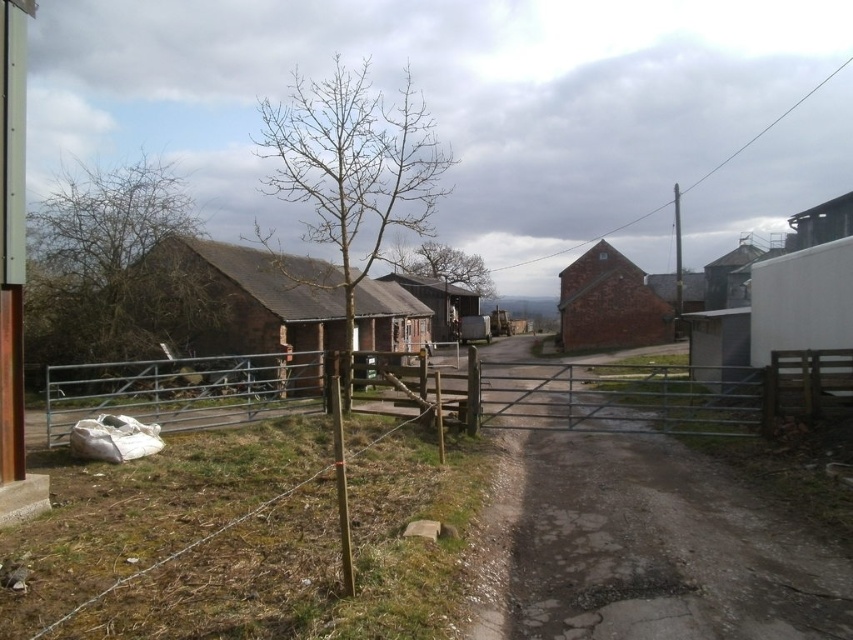
Question: Which point is closer to the camera?

Choices:
 (A) (178, 365)
 (B) (578, 340)
 (C) (407, 305)

Answer: (A)

Question: Which point appears closest to the camera in this image?

Choices:
 (A) (480, 276)
 (B) (625, 314)
 (C) (366, 342)

Answer: (C)

Question: Which of the following is the farthest from the observer?

Choices:
 (A) brown wooden hut at left
 (B) brown wooden hut at center
 (C) green leafy tree at upper center

Answer: (C)

Question: Does metallic gate at center appear under brown wooden hut at center?

Choices:
 (A) no
 (B) yes

Answer: (B)

Question: Can you confirm if brown leafless tree at left is thinner than bare wood tree at center?

Choices:
 (A) no
 (B) yes

Answer: (A)

Question: Is brown leafless tree at left smaller than green leafy tree at upper center?

Choices:
 (A) no
 (B) yes

Answer: (A)